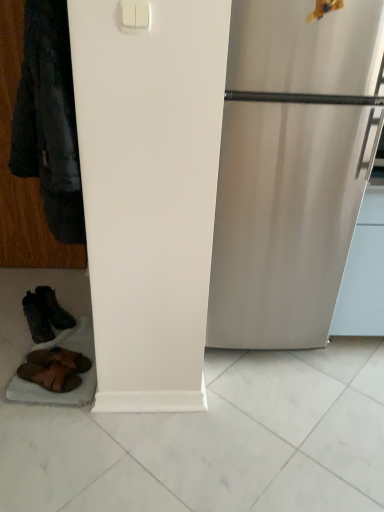
Question: Is white plastic light switch at upper center bigger or smaller than dark brown leather boots at lower left, the 1th footwear viewed from the back?

Choices:
 (A) small
 (B) big

Answer: (A)

Question: From a real-world perspective, relative to dark brown leather boots at lower left, the 1th footwear viewed from the back, is white plastic light switch at upper center vertically above or below?

Choices:
 (A) below
 (B) above

Answer: (B)

Question: Which of these objects is positioned farthest from the dark brown leather boots at lower left, the 1th footwear viewed from the back?

Choices:
 (A) brown leather sandals at lower left, placed as the first footwear when sorted from front to back
 (B) white plastic light switch at upper center
 (C) brown leather sandals at lower left, which ranks as the second footwear in back-to-front order

Answer: (B)

Question: Which is nearer to the white plastic light switch at upper center?

Choices:
 (A) dark brown leather boots at lower left, the 1th footwear viewed from the back
 (B) brown leather sandals at lower left, which ranks as the third footwear in back-to-front order
 (C) brown leather sandals at lower left, which ranks as the second footwear in back-to-front order

Answer: (B)